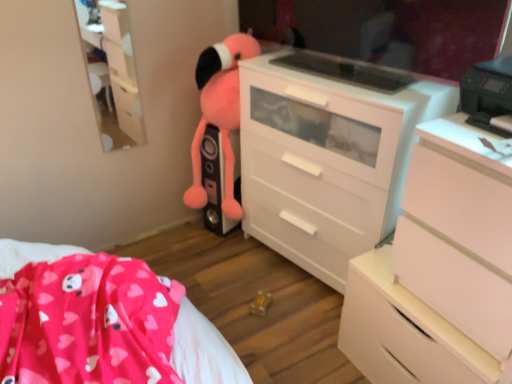
Question: Choose the correct answer: Is glossy plastic mirror at upper center inside matte white cabinet at upper left or outside it?

Choices:
 (A) outside
 (B) inside

Answer: (A)

Question: Considering the positions of glossy plastic mirror at upper center and matte white cabinet at upper left in the image, is glossy plastic mirror at upper center bigger or smaller than matte white cabinet at upper left?

Choices:
 (A) small
 (B) big

Answer: (B)

Question: Which object is positioned closest to the matte white cabinet at upper left?

Choices:
 (A) white glossy chest of drawers at center, acting as the 2th chest of drawers starting from the front
 (B) pink plush toy at center
 (C) glossy plastic mirror at upper center
 (D) white matte chest of drawers at right, which ranks as the second chest of drawers in back-to-front order
 (E) white matte drawer at center

Answer: (B)

Question: Which is nearer to the pink plush toy at center?

Choices:
 (A) white matte drawer at center
 (B) glossy plastic mirror at upper center
 (C) white matte chest of drawers at right, the first chest of drawers viewed from the front
 (D) white glossy chest of drawers at center, acting as the 2th chest of drawers starting from the front
 (E) matte white cabinet at upper left

Answer: (D)